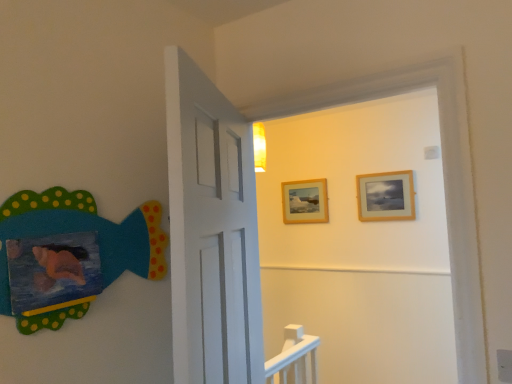
Question: Does wooden frame at upper center, marked as the first picture frame in a back-to-front arrangement, appear on the left side of matte felt fish at left?

Choices:
 (A) yes
 (B) no

Answer: (B)

Question: Is wooden frame at upper center, the 1th picture frame in the left-to-right sequence, facing away from matte felt fish at left?

Choices:
 (A) no
 (B) yes

Answer: (A)

Question: Does wooden frame at upper center, the 1th picture frame in the left-to-right sequence, turn towards matte felt fish at left?

Choices:
 (A) no
 (B) yes

Answer: (B)

Question: Can you confirm if wooden frame at upper center, the second picture frame viewed from the right, is taller than matte felt fish at left?

Choices:
 (A) no
 (B) yes

Answer: (A)

Question: Does wooden frame at upper center, the second picture frame viewed from the right, have a lesser width compared to matte felt fish at left?

Choices:
 (A) yes
 (B) no

Answer: (A)

Question: Does wooden frame at upper center, the 1th picture frame in the left-to-right sequence, lie in front of matte felt fish at left?

Choices:
 (A) yes
 (B) no

Answer: (B)

Question: Considering the relative sizes of wooden frame at upper center, the 1th picture frame in the left-to-right sequence, and wooden frame at upper right, which ranks as the 2th picture frame in left-to-right order, in the image provided, is wooden frame at upper center, the 1th picture frame in the left-to-right sequence, shorter than wooden frame at upper right, which ranks as the 2th picture frame in left-to-right order,?

Choices:
 (A) no
 (B) yes

Answer: (B)

Question: Is wooden frame at upper center, the 1th picture frame in the left-to-right sequence, taller than wooden frame at upper right, the 2th picture frame when ordered from back to front?

Choices:
 (A) yes
 (B) no

Answer: (B)

Question: Does wooden frame at upper center, the 1th picture frame in the left-to-right sequence, turn towards wooden frame at upper right, positioned as the 1th picture frame in right-to-left order?

Choices:
 (A) no
 (B) yes

Answer: (A)

Question: Does wooden frame at upper center, the 2th picture frame viewed from the front, have a greater width compared to wooden frame at upper right, positioned as the 1th picture frame in right-to-left order?

Choices:
 (A) no
 (B) yes

Answer: (A)

Question: Does wooden frame at upper center, marked as the first picture frame in a back-to-front arrangement, have a lesser width compared to wooden frame at upper right, which ranks as the 2th picture frame in left-to-right order?

Choices:
 (A) yes
 (B) no

Answer: (A)

Question: Is the position of wooden frame at upper center, the second picture frame viewed from the right, more distant than that of wooden frame at upper right, the 2th picture frame when ordered from back to front?

Choices:
 (A) yes
 (B) no

Answer: (A)

Question: From the image's perspective, does matte felt fish at left appear higher than wooden frame at upper center, the 1th picture frame in the left-to-right sequence?

Choices:
 (A) yes
 (B) no

Answer: (B)